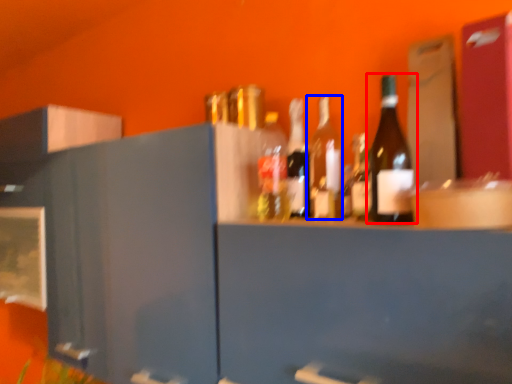
Question: Which object appears closest to the camera in this image, bottle (highlighted by a red box) or bottle (highlighted by a blue box)?

Choices:
 (A) bottle
 (B) bottle

Answer: (A)